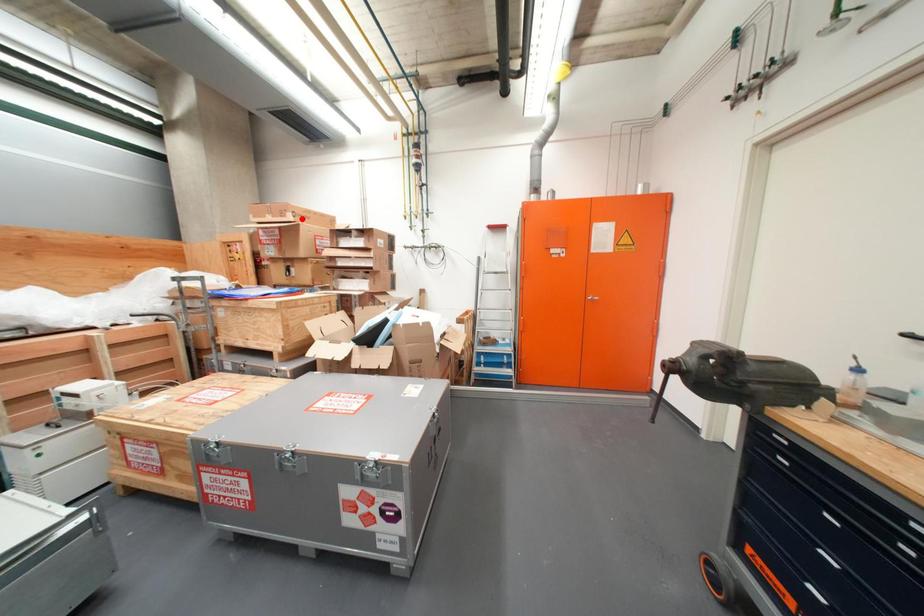
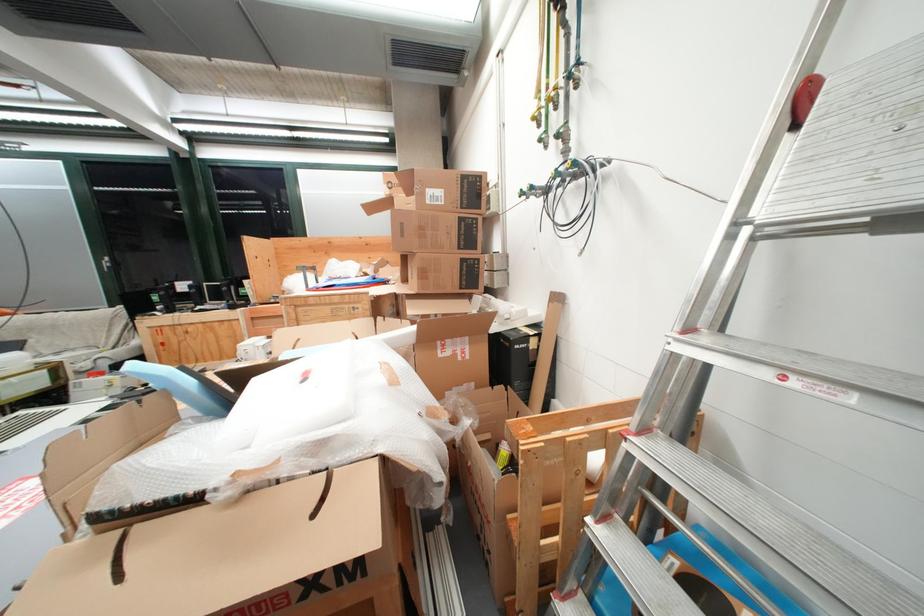
Where in the second image is the point corresponding to the highlighted location from the first image?

(398, 192)